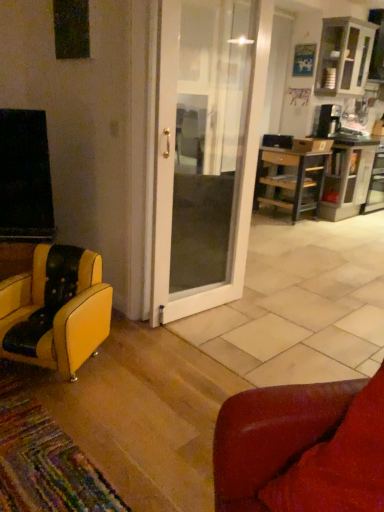
Question: Is yellow leather chair at lower left, the 2th chair from the right, positioned beyond the bounds of wooden cabinet at right?

Choices:
 (A) no
 (B) yes

Answer: (B)

Question: Considering the relative sizes of yellow leather chair at lower left, which is the 2th chair from front to back, and wooden cabinet at right in the image provided, is yellow leather chair at lower left, which is the 2th chair from front to back, taller than wooden cabinet at right?

Choices:
 (A) no
 (B) yes

Answer: (A)

Question: Can you confirm if yellow leather chair at lower left, the 1th chair when ordered from left to right, is bigger than wooden cabinet at right?

Choices:
 (A) yes
 (B) no

Answer: (B)

Question: From the image's perspective, is yellow leather chair at lower left, which is counted as the first chair, starting from the back, under wooden cabinet at right?

Choices:
 (A) no
 (B) yes

Answer: (B)

Question: Does yellow leather chair at lower left, the 2th chair from the right, have a greater width compared to wooden cabinet at right?

Choices:
 (A) yes
 (B) no

Answer: (B)

Question: Is wooden cabinet at right wider or thinner than white glossy cabinet at upper right?

Choices:
 (A) wide
 (B) thin

Answer: (A)

Question: Relative to white glossy cabinet at upper right, is wooden cabinet at right in front or behind?

Choices:
 (A) behind
 (B) front

Answer: (A)

Question: Based on their sizes in the image, would you say wooden cabinet at right is bigger or smaller than white glossy cabinet at upper right?

Choices:
 (A) big
 (B) small

Answer: (A)

Question: From the image's perspective, is wooden cabinet at right positioned above or below white glossy cabinet at upper right?

Choices:
 (A) above
 (B) below

Answer: (B)

Question: Considering the positions of point (263, 202) and point (238, 420), is point (263, 202) closer or farther from the camera than point (238, 420)?

Choices:
 (A) closer
 (B) farther

Answer: (B)

Question: Is wooden desk at right inside or outside of leather couch at lower right, marked as the first chair in a front-to-back arrangement?

Choices:
 (A) inside
 (B) outside

Answer: (B)

Question: From the image's perspective, is wooden desk at right above or below leather couch at lower right, marked as the first chair in a front-to-back arrangement?

Choices:
 (A) above
 (B) below

Answer: (A)

Question: From a real-world perspective, is wooden desk at right above or below leather couch at lower right, which is counted as the second chair, starting from the left?

Choices:
 (A) below
 (B) above

Answer: (A)

Question: Looking at the image, does wooden cabinet at right seem bigger or smaller compared to wooden desk at right?

Choices:
 (A) big
 (B) small

Answer: (A)

Question: Is point (369, 151) positioned closer to the camera than point (311, 196)?

Choices:
 (A) closer
 (B) farther

Answer: (B)